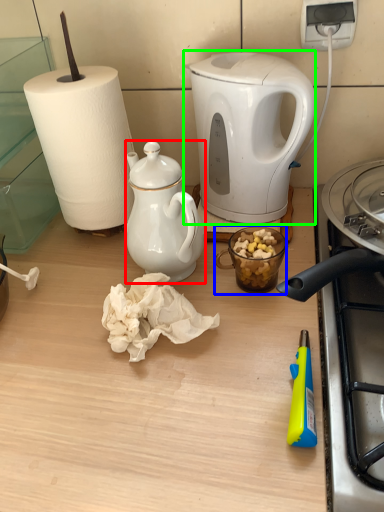
Question: Which object is positioned farthest from teapot (highlighted by a red box)? Select from coffee cup (highlighted by a blue box) and kettle (highlighted by a green box).

Choices:
 (A) coffee cup
 (B) kettle

Answer: (B)